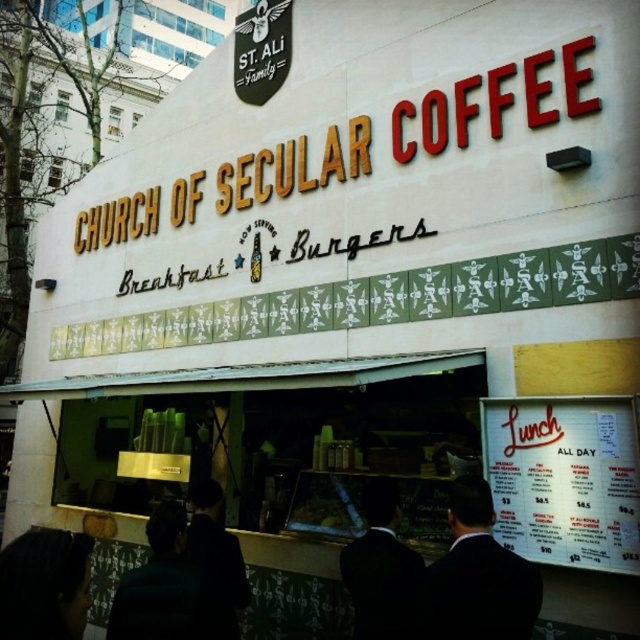
You are a customer standing in front of the cafe and want to order lunch. You see a white paper menu at lower right and a dark fabric jacket at center. Which object is located to the right side of the other?

The white paper menu at lower right is to the right of dark fabric jacket at center.

You are a customer standing in front of the Church of Secular Coffee. You see a white paper menu at lower right and a dark brown leather jacket at lower left. Which object is positioned to the right side of the other?

The white paper menu at lower right is to the right of dark brown leather jacket at lower left.